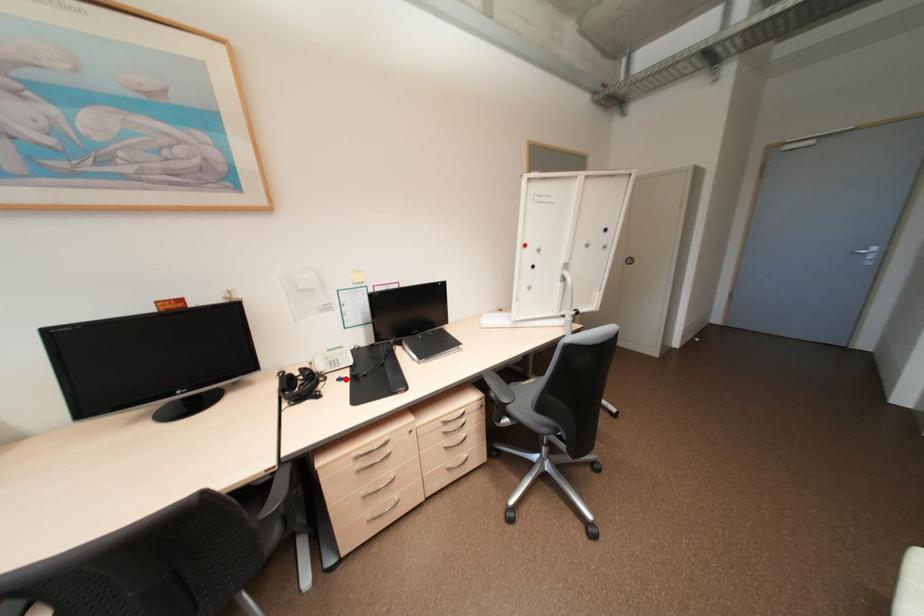
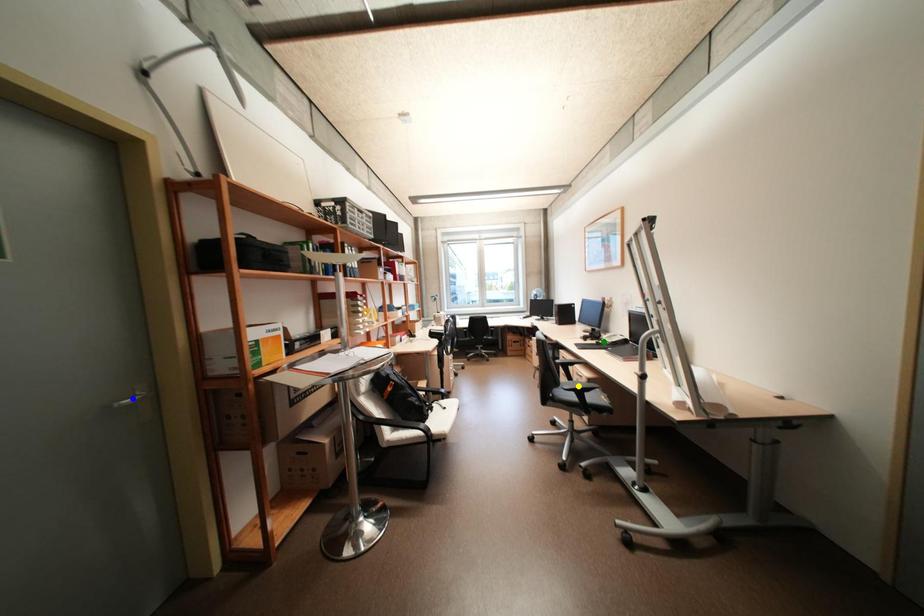
Question: I am providing you with two images of the same scene from different viewpoints. A red point is marked on the first image. You are given multiple points on the second image. Can you choose the point in image 2 that corresponds to the point in image 1?

Choices:
 (A) green point
 (B) yellow point
 (C) blue point

Answer: (A)